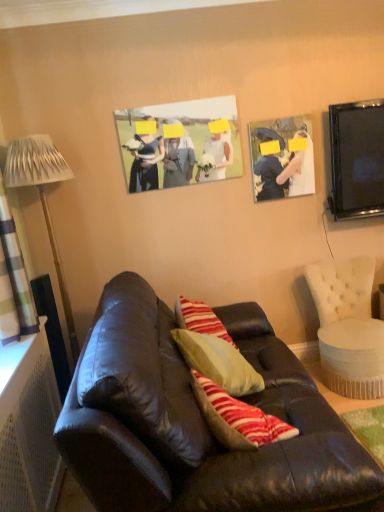
Describe the element at coordinates (357, 159) in the screenshot. I see `black glossy tv at upper right` at that location.

This screenshot has width=384, height=512. What do you see at coordinates (180, 143) in the screenshot? I see `matte paper photo at center, arranged as the 1th picture frame when viewed from the left` at bounding box center [180, 143].

In order to click on white tufted fabric chair at right in this screenshot , I will do `click(348, 327)`.

What do you see at coordinates (281, 158) in the screenshot? Image resolution: width=384 pixels, height=512 pixels. I see `matte black photo frame at upper right, arranged as the 1th picture frame when viewed from the right` at bounding box center [281, 158].

Where is `metallic silver lamp at left`? The height and width of the screenshot is (512, 384). metallic silver lamp at left is located at coordinates (42, 199).

Looking at their sizes, would you say matte black couch at center is wider or thinner than white perforated radiator at lower left?

In the image, matte black couch at center appears to be wider than white perforated radiator at lower left.

Considering the positions of objects matte black couch at center and white perforated radiator at lower left in the image provided, who is more to the left, matte black couch at center or white perforated radiator at lower left?

Positioned to the left is white perforated radiator at lower left.

Is matte black couch at center in contact with white perforated radiator at lower left?

They are not placed beside each other.

Where is `radiator below the matte black couch at center (from the image's perspective)`? This screenshot has width=384, height=512. radiator below the matte black couch at center (from the image's perspective) is located at coordinates (31, 446).

Which object is positioned more to the left, plaid fabric curtain at left or white perforated radiator at lower left?

From the viewer's perspective, plaid fabric curtain at left appears more on the left side.

Is plaid fabric curtain at left closer to camera compared to white perforated radiator at lower left?

No, plaid fabric curtain at left is further to the viewer.

Measure the distance from plaid fabric curtain at left to white perforated radiator at lower left.

The distance of plaid fabric curtain at left from white perforated radiator at lower left is 18.59 inches.

Considering the sizes of plaid fabric curtain at left and white perforated radiator at lower left in the image, is plaid fabric curtain at left wider or thinner than white perforated radiator at lower left?

Considering their sizes, plaid fabric curtain at left looks slimmer than white perforated radiator at lower left.

Is matte black photo frame at upper right, which appears as the second picture frame when viewed from the left, with white tufted fabric chair at right?

No, matte black photo frame at upper right, which appears as the second picture frame when viewed from the left, is not next to white tufted fabric chair at right.

From a real-world perspective, who is located lower, matte black photo frame at upper right, which appears as the second picture frame when viewed from the left, or white tufted fabric chair at right?

From a 3D spatial view, white tufted fabric chair at right is below.

From the image's perspective, does matte black photo frame at upper right, which appears as the second picture frame when viewed from the left, appear lower than white tufted fabric chair at right?

Incorrect, from the image's perspective, matte black photo frame at upper right, which appears as the second picture frame when viewed from the left, is higher than white tufted fabric chair at right.

Is matte black photo frame at upper right, which appears as the second picture frame when viewed from the left, inside the boundaries of white tufted fabric chair at right, or outside?

matte black photo frame at upper right, which appears as the second picture frame when viewed from the left, is not inside white tufted fabric chair at right, it's outside.

Is matte black couch at center at the back of matte paper photo at center, the second picture frame from the right?

No, matte black couch at center is not at the back of matte paper photo at center, the second picture frame from the right.

Does matte paper photo at center, arranged as the 1th picture frame when viewed from the left, have a greater width compared to matte black couch at center?

Incorrect, the width of matte paper photo at center, arranged as the 1th picture frame when viewed from the left, does not surpass that of matte black couch at center.

Is matte paper photo at center, the second picture frame from the right, positioned beyond the bounds of matte black couch at center?

That's correct, matte paper photo at center, the second picture frame from the right, is outside of matte black couch at center.

Which object is more forward, matte paper photo at center, arranged as the 1th picture frame when viewed from the left, or matte black couch at center?

matte black couch at center is more forward.

In the image, is black glossy tv at upper right positioned in front of or behind matte black couch at center?

Clearly, black glossy tv at upper right is behind matte black couch at center.

How different are the orientations of black glossy tv at upper right and matte black couch at center in degrees?

The angle between the facing direction of black glossy tv at upper right and the facing direction of matte black couch at center is 91.7 degrees.

Who is taller, black glossy tv at upper right or matte black couch at center?

matte black couch at center is taller.

Is matte paper photo at center, the second picture frame from the right, looking in the opposite direction of black glossy tv at upper right?

matte paper photo at center, the second picture frame from the right, does not have its back to black glossy tv at upper right.

Can you tell me how much matte paper photo at center, arranged as the 1th picture frame when viewed from the left, and black glossy tv at upper right differ in facing direction?

The facing directions of matte paper photo at center, arranged as the 1th picture frame when viewed from the left, and black glossy tv at upper right are 1 degrees apart.

Which object is thinner, matte paper photo at center, the second picture frame from the right, or black glossy tv at upper right?

matte paper photo at center, the second picture frame from the right, is thinner.

Which of these two, matte paper photo at center, the second picture frame from the right, or black glossy tv at upper right, is bigger?

black glossy tv at upper right is bigger.

Considering the positions of points (3, 426) and (48, 181), is point (3, 426) farther from camera compared to point (48, 181)?

That is False.

Considering the relative positions of white perforated radiator at lower left and metallic silver lamp at left in the image provided, is white perforated radiator at lower left behind metallic silver lamp at left?

No, it is not.

Consider the image. Is white perforated radiator at lower left bigger or smaller than metallic silver lamp at left?

Clearly, white perforated radiator at lower left is smaller in size than metallic silver lamp at left.

Is white perforated radiator at lower left taller than metallic silver lamp at left?

No.

Locate an element on the screen. The height and width of the screenshot is (512, 384). studio couch in front of the white perforated radiator at lower left is located at coordinates (205, 426).

What are the coordinates of `radiator that appears below the plaid fabric curtain at left (from a real-world perspective)` in the screenshot? It's located at (31, 446).

Estimate the real-world distances between objects in this image. Which object is further from metallic silver lamp at left, matte paper photo at center, the second picture frame from the right, or white perforated radiator at lower left?

white perforated radiator at lower left is further to metallic silver lamp at left.

Estimate the real-world distances between objects in this image. Which object is closer to metallic silver lamp at left, plaid fabric curtain at left or matte paper photo at center, arranged as the 1th picture frame when viewed from the left?

plaid fabric curtain at left.

Looking at the image, which one is located further to white tufted fabric chair at right, metallic silver lamp at left or matte black photo frame at upper right, arranged as the 1th picture frame when viewed from the right?

metallic silver lamp at left.

Looking at the image, which one is located further to matte black couch at center, white tufted fabric chair at right or metallic silver lamp at left?

metallic silver lamp at left.

Based on the photo, which object lies nearer to the anchor point plaid fabric curtain at left, white perforated radiator at lower left or metallic silver lamp at left?

Among the two, white perforated radiator at lower left is located nearer to plaid fabric curtain at left.

Considering their positions, is plaid fabric curtain at left positioned further to matte black couch at center than white tufted fabric chair at right?

white tufted fabric chair at right lies further to matte black couch at center than the other object.

Looking at the image, which one is located closer to matte black photo frame at upper right, arranged as the 1th picture frame when viewed from the right, metallic silver lamp at left or white perforated radiator at lower left?

metallic silver lamp at left.

Consider the image. Based on their spatial positions, is matte paper photo at center, arranged as the 1th picture frame when viewed from the left, or white tufted fabric chair at right closer to matte black couch at center?

white tufted fabric chair at right.

Where is `studio couch between white perforated radiator at lower left and black glossy tv at upper right`? studio couch between white perforated radiator at lower left and black glossy tv at upper right is located at coordinates (205, 426).

This screenshot has height=512, width=384. In order to click on radiator between metallic silver lamp at left and white tufted fabric chair at right in this screenshot , I will do `click(31, 446)`.

Where is `picture frame between matte paper photo at center, arranged as the 1th picture frame when viewed from the left, and white perforated radiator at lower left, in the vertical direction`? Image resolution: width=384 pixels, height=512 pixels. picture frame between matte paper photo at center, arranged as the 1th picture frame when viewed from the left, and white perforated radiator at lower left, in the vertical direction is located at coordinates (281, 158).

Identify the location of studio couch situated between plaid fabric curtain at left and white tufted fabric chair at right from left to right. The height and width of the screenshot is (512, 384). (205, 426).